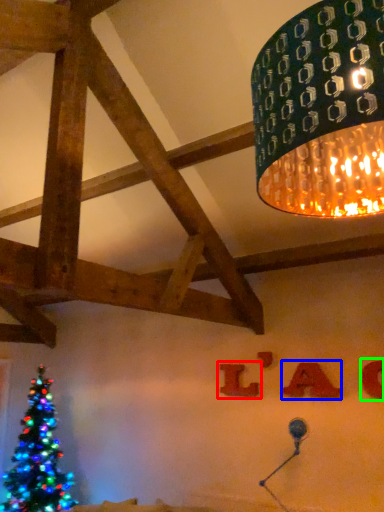
Question: Which object is positioned farthest from alphabet (highlighted by a red box)? Select from alphabet (highlighted by a blue box) and alphabet (highlighted by a green box).

Choices:
 (A) alphabet
 (B) alphabet

Answer: (B)